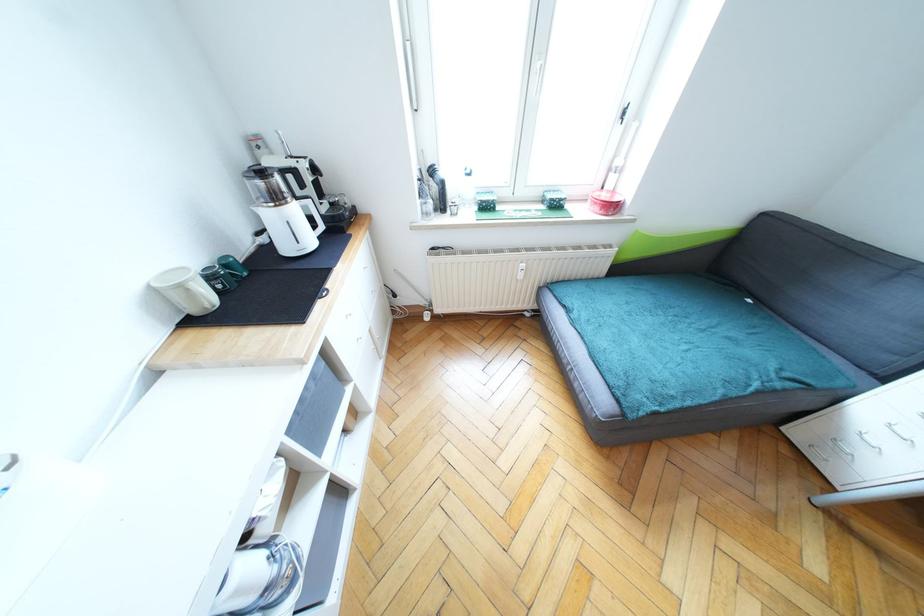
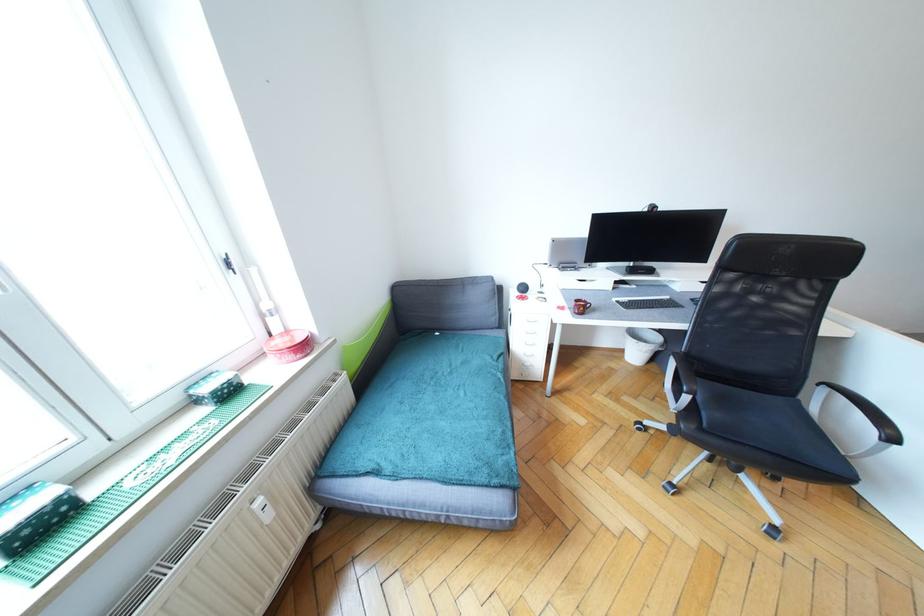
Find the pixel in the second image that matches pixel 489 209 in the first image.

(45, 530)